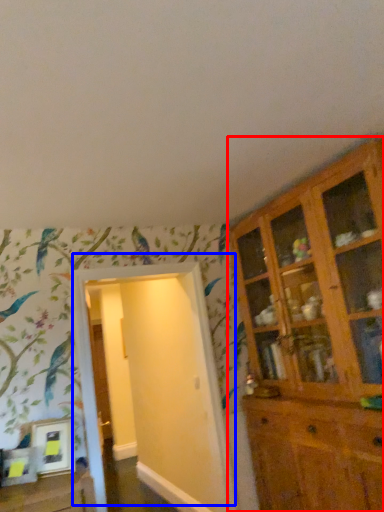
Question: Which point is closer to the camera, cupboard (highlighted by a red box) or door (highlighted by a blue box)?

Choices:
 (A) cupboard
 (B) door

Answer: (A)